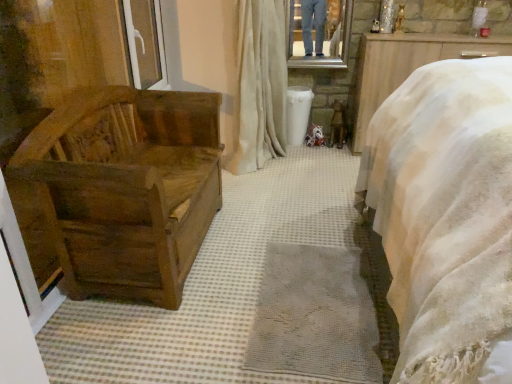
Question: Is satin beige curtain at center touching metallic reflective mirror at upper center?

Choices:
 (A) no
 (B) yes

Answer: (A)

Question: Is satin beige curtain at center not close to metallic reflective mirror at upper center?

Choices:
 (A) yes
 (B) no

Answer: (B)

Question: Considering the relative sizes of satin beige curtain at center and metallic reflective mirror at upper center in the image provided, is satin beige curtain at center bigger than metallic reflective mirror at upper center?

Choices:
 (A) no
 (B) yes

Answer: (B)

Question: Is satin beige curtain at center looking in the opposite direction of metallic reflective mirror at upper center?

Choices:
 (A) yes
 (B) no

Answer: (B)

Question: Does satin beige curtain at center have a greater width compared to metallic reflective mirror at upper center?

Choices:
 (A) no
 (B) yes

Answer: (B)

Question: Does satin beige curtain at center have a lesser height compared to metallic reflective mirror at upper center?

Choices:
 (A) yes
 (B) no

Answer: (B)

Question: Is wooden chest at left directly adjacent to metallic reflective mirror at upper center?

Choices:
 (A) no
 (B) yes

Answer: (A)

Question: Is wooden chest at left not near metallic reflective mirror at upper center?

Choices:
 (A) yes
 (B) no

Answer: (A)

Question: From a real-world perspective, is wooden chest at left positioned under metallic reflective mirror at upper center based on gravity?

Choices:
 (A) no
 (B) yes

Answer: (B)

Question: From a real-world perspective, is wooden chest at left positioned over metallic reflective mirror at upper center based on gravity?

Choices:
 (A) no
 (B) yes

Answer: (A)

Question: Does wooden chest at left have a smaller size compared to metallic reflective mirror at upper center?

Choices:
 (A) no
 (B) yes

Answer: (A)

Question: Does wooden chest at left have a larger size compared to metallic reflective mirror at upper center?

Choices:
 (A) yes
 (B) no

Answer: (A)

Question: Is satin beige curtain at center oriented towards white plastic window at upper left?

Choices:
 (A) no
 (B) yes

Answer: (A)